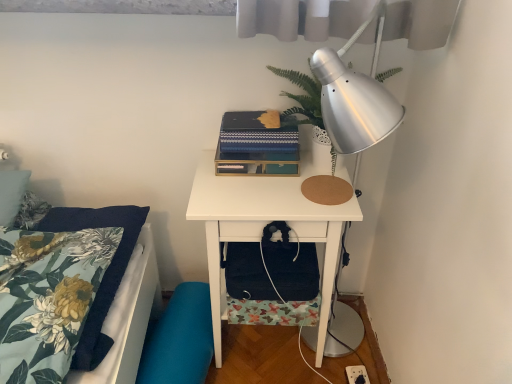
This screenshot has height=384, width=512. What are the coordinates of `free spot above floral fabric pillow at left (from a real-world perspective)` in the screenshot? It's located at (51, 266).